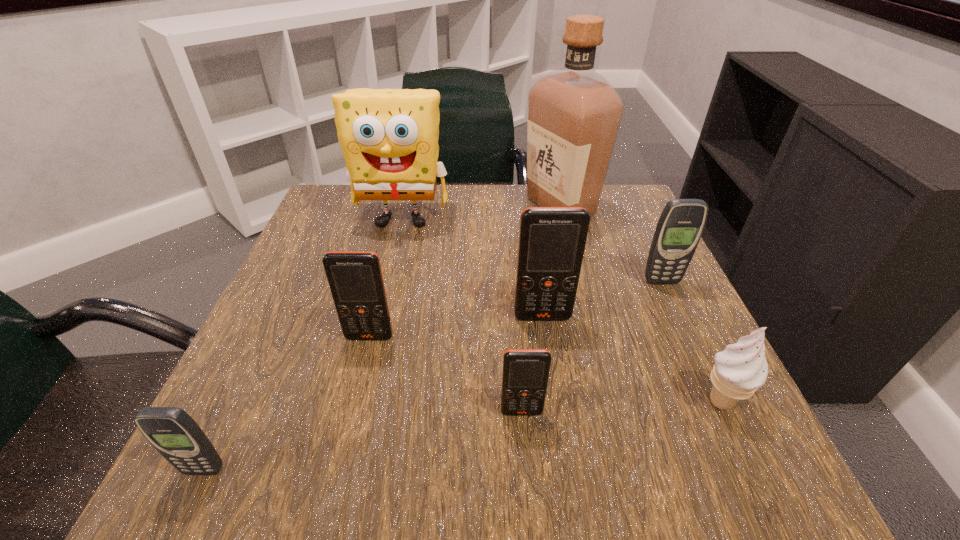
The width and height of the screenshot is (960, 540). What are the coordinates of `cellular telephone object that ranks as the fourth closest to the icecream` in the screenshot? It's located at (x=355, y=278).

Select which orange cellular telephone is the closest to the nearest orange cellular telephone. Please provide its 2D coordinates. Your answer should be formatted as a tuple, i.e. [(x, y)], where the tuple contains the x and y coordinates of a point satisfying the conditions above.

[(552, 240)]

Where is `orange cellular telephone that is the second closest to the smaller gray cellular telephone`? This screenshot has height=540, width=960. orange cellular telephone that is the second closest to the smaller gray cellular telephone is located at coordinates (525, 375).

Find the location of a particular element. This screenshot has height=540, width=960. free spot that satisfies the following two spatial constraints: 1. on the front-facing side of the brown liquor; 2. on the face of the yellow sponge is located at coordinates (564, 219).